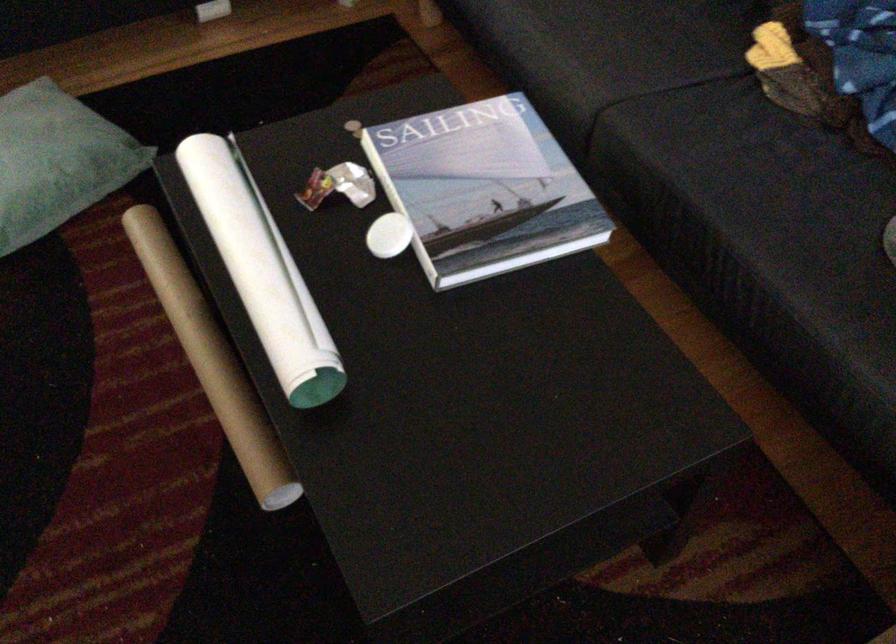
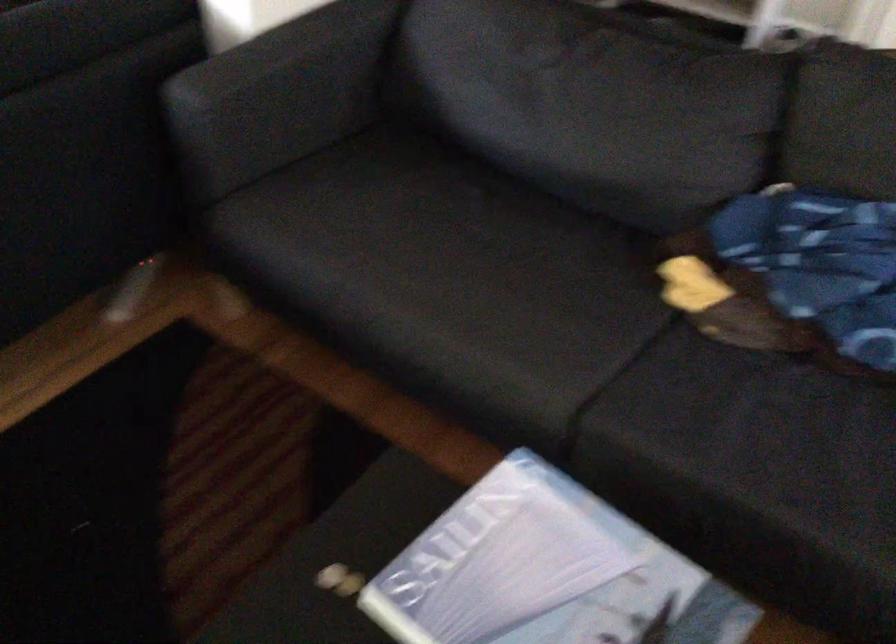
In a continuous first-person perspective shot, in which direction is the camera moving?

The movement direction of the cameraman is left, forward.